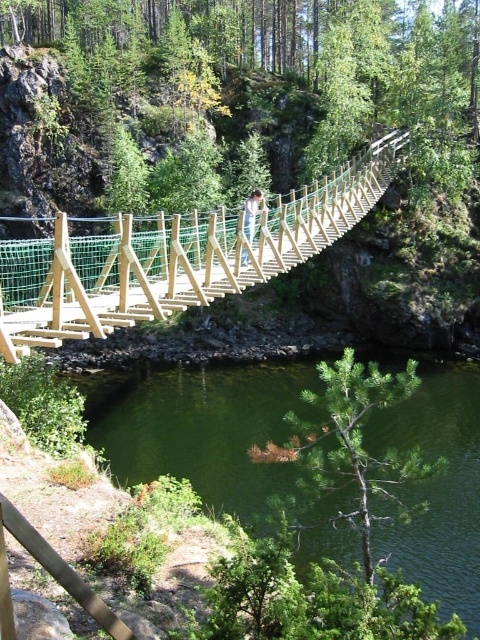
You are a hiker planning to cross the wooden suspension bridge at center. Given that the bridge is at coordinates point 0.403, 0.362, can you confirm if this position is suitable for safely crossing the bridge?

The wooden suspension bridge at center is located at point [173,257], which is the correct position for safe crossing as it is centrally positioned over the water body.

You are standing on the wooden suspension bridge and notice the green water at lower center and the wooden post at center. Which object is positioned to the right side from your viewpoint?

The green water at lower center is to the right of the wooden post at center, so the green water at lower center is positioned to the right side from your viewpoint.